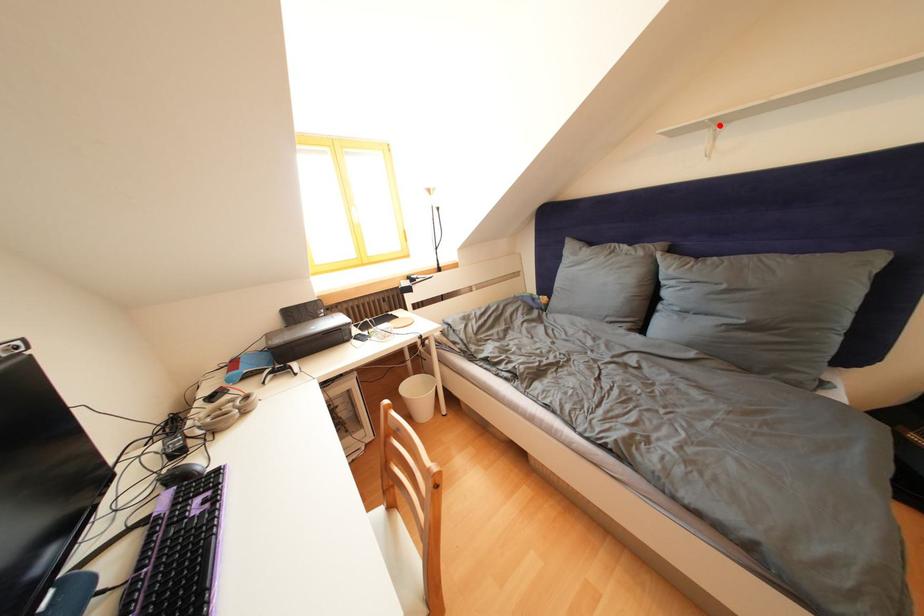
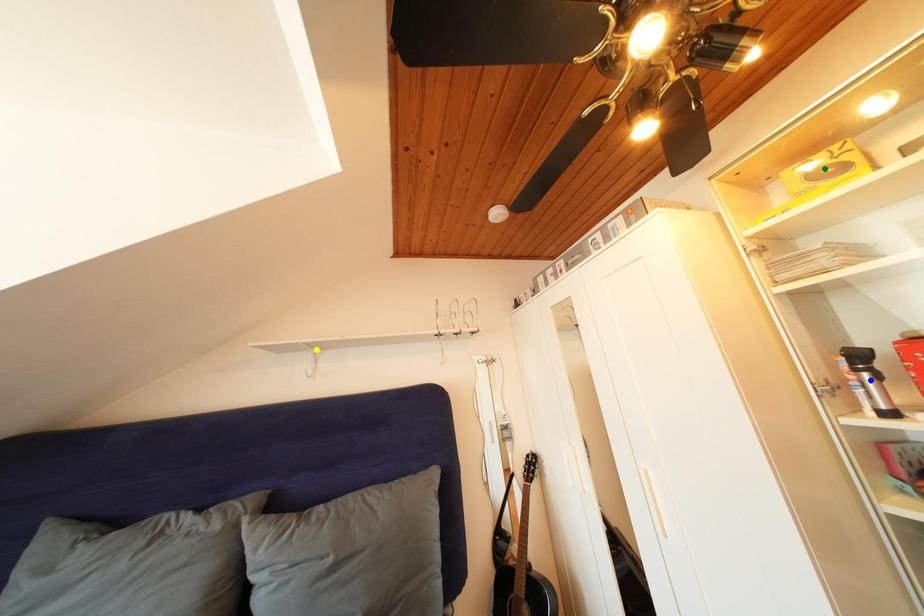
Question: I am providing you with two images of the same scene from different viewpoints. A red point is marked on the first image. You are given multiple points on the second image. In image 2, which mark is for the same physical point as the one in image 1?

Choices:
 (A) blue point
 (B) yellow point
 (C) green point

Answer: (B)